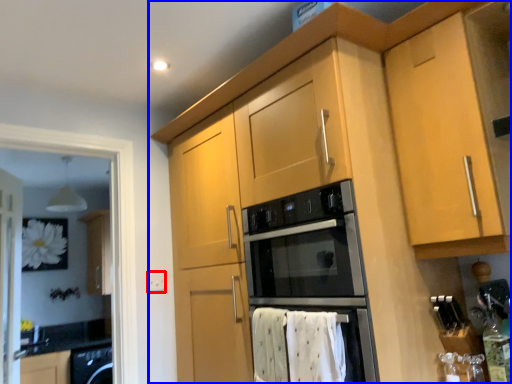
Question: Among these objects, which one is farthest to the camera, electric outlet (highlighted by a red box) or cabinetry (highlighted by a blue box)?

Choices:
 (A) electric outlet
 (B) cabinetry

Answer: (A)